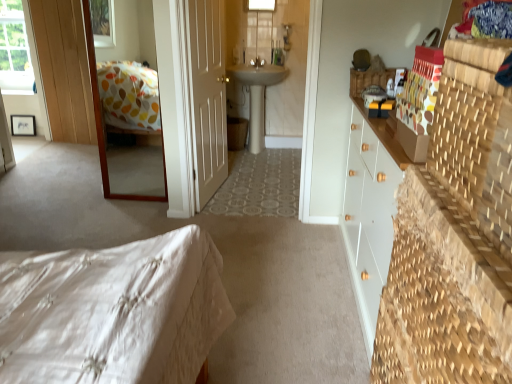
Find the location of a particular element. This screenshot has height=384, width=512. wooden-framed mirror at upper left is located at coordinates (126, 122).

At what (x,y) coordinates should I click in order to perform the action: click on white matte door at center. Please return your answer as a coordinate pair (x, y). Looking at the image, I should click on (207, 96).

Describe the element at coordinates (257, 96) in the screenshot. The height and width of the screenshot is (384, 512). I see `white ceramic sink at center` at that location.

Where is `wooden-framed mirror at upper left`? The height and width of the screenshot is (384, 512). wooden-framed mirror at upper left is located at coordinates (126, 122).

Could transparent glass window at upper center, placed as the first window when sorted from right to left, be considered to be inside wooden-framed mirror at upper left?

No, wooden-framed mirror at upper left does not contain transparent glass window at upper center, placed as the first window when sorted from right to left.

In the image, is wooden-framed mirror at upper left on the left side or the right side of transparent glass window at upper center, which ranks as the second window in back-to-front order?

In the image, wooden-framed mirror at upper left appears on the left side of transparent glass window at upper center, which ranks as the second window in back-to-front order.

Does point (146, 190) lie behind point (275, 0)?

No, it is not.

Looking at this image, from a real-world perspective, relative to transparent glass window at upper center, which is the 1th window in front-to-back order, is wooden-framed mirror at upper left vertically above or below?

wooden-framed mirror at upper left is situated lower than transparent glass window at upper center, which is the 1th window in front-to-back order, in the real world.

In the scene shown: Between wooden-framed mirror at upper left and white matte door at center, which one has less height?

With less height is wooden-framed mirror at upper left.

Is wooden-framed mirror at upper left in contact with white matte door at center?

There is a gap between wooden-framed mirror at upper left and white matte door at center.

Considering the points (127, 129) and (203, 117), which point is behind, point (127, 129) or point (203, 117)?

The point (127, 129) is more distant.

Which is behind, point (5, 82) or point (261, 72)?

The point (5, 82) is farther.

Is transparent glass window at upper left, which is the 2th window from front to back, not close to white ceramic sink at center?

transparent glass window at upper left, which is the 2th window from front to back, is far away from white ceramic sink at center.

Which object is thinner, transparent glass window at upper left, which is the first window in back-to-front order, or white ceramic sink at center?

transparent glass window at upper left, which is the first window in back-to-front order.

In the scene shown: Could you tell me if transparent glass window at upper left, which is the first window in back-to-front order, is turned towards white ceramic sink at center?

No, transparent glass window at upper left, which is the first window in back-to-front order, is not oriented towards white ceramic sink at center.

From the image's perspective, which one is positioned higher, wooden-framed mirror at upper left or transparent glass window at upper left, the 1th window in the left-to-right sequence?

transparent glass window at upper left, the 1th window in the left-to-right sequence, is shown above in the image.

Between wooden-framed mirror at upper left and transparent glass window at upper left, which is the 2th window from front to back, which one has less height?

transparent glass window at upper left, which is the 2th window from front to back, is shorter.

Considering the relative sizes of wooden-framed mirror at upper left and transparent glass window at upper left, the 1th window in the left-to-right sequence, in the image provided, is wooden-framed mirror at upper left smaller than transparent glass window at upper left, the 1th window in the left-to-right sequence,?

Yes, wooden-framed mirror at upper left is smaller than transparent glass window at upper left, the 1th window in the left-to-right sequence.

Considering the positions of points (126, 129) and (3, 72), is point (126, 129) closer to camera compared to point (3, 72)?

No, it is behind (3, 72).

Is transparent glass window at upper left, which is counted as the second window, starting from the right, touching white quilted bed at lower left?

No, transparent glass window at upper left, which is counted as the second window, starting from the right, is not with white quilted bed at lower left.

In the scene shown: Can you confirm if transparent glass window at upper left, which is the 2th window from front to back, is bigger than white quilted bed at lower left?

No, transparent glass window at upper left, which is the 2th window from front to back, is not bigger than white quilted bed at lower left.

Is transparent glass window at upper left, which is counted as the second window, starting from the right, turned away from white quilted bed at lower left?

transparent glass window at upper left, which is counted as the second window, starting from the right, is not turned away from white quilted bed at lower left.

Is transparent glass window at upper left, which is the first window in back-to-front order, in front of or behind white quilted bed at lower left in the image?

Clearly, transparent glass window at upper left, which is the first window in back-to-front order, is behind white quilted bed at lower left.

Where is `mirror behind the white matte door at center`? mirror behind the white matte door at center is located at coordinates (126, 122).

Could you tell me if white matte door at center is turned towards wooden-framed mirror at upper left?

No.

Considering the sizes of objects white matte door at center and wooden-framed mirror at upper left in the image provided, who is taller, white matte door at center or wooden-framed mirror at upper left?

white matte door at center.

From a real-world perspective, which is physically above, white matte door at center or wooden-framed mirror at upper left?

In real-world perspective, white matte door at center is above.

Who is shorter, white ceramic sink at center or white quilted bed at lower left?

white quilted bed at lower left.

Is white ceramic sink at center not within white quilted bed at lower left?

Yes.

Is white ceramic sink at center with white quilted bed at lower left?

No, white ceramic sink at center is not next to white quilted bed at lower left.

Find the location of a particular element. The height and width of the screenshot is (384, 512). the 2nd window above when counting from the wooden-framed mirror at upper left (from the image's perspective) is located at coordinates (260, 5).

Locate an element on the screen. mirror directly beneath the white matte door at center (from a real-world perspective) is located at coordinates (126, 122).

Looking at the image, which one is located further to white matte door at center, wooden-framed mirror at upper left or transparent glass window at upper left, which is the 2th window from front to back?

transparent glass window at upper left, which is the 2th window from front to back, is further to white matte door at center.

From the image, which object appears to be farther from white matte door at center, wooden-framed mirror at upper left or transparent glass window at upper center, placed as the first window when sorted from right to left?

transparent glass window at upper center, placed as the first window when sorted from right to left, is positioned further to the anchor white matte door at center.

Which object lies further to the anchor point transparent glass window at upper left, which is counted as the second window, starting from the right, white quilted bed at lower left or white matte door at center?

Based on the image, white quilted bed at lower left appears to be further to transparent glass window at upper left, which is counted as the second window, starting from the right.

Based on their spatial positions, is transparent glass window at upper left, which is the 2th window from front to back, or white matte door at center closer to white quilted bed at lower left?

white matte door at center lies closer to white quilted bed at lower left than the other object.

Looking at the image, which one is located closer to white matte door at center, white ceramic sink at center or white quilted bed at lower left?

white ceramic sink at center.

Which object lies further to the anchor point white ceramic sink at center, transparent glass window at upper center, which ranks as the second window in back-to-front order, or white quilted bed at lower left?

white quilted bed at lower left.

Looking at the image, which one is located further to transparent glass window at upper center, placed as the first window when sorted from right to left, transparent glass window at upper left, the 1th window in the left-to-right sequence, or white ceramic sink at center?

transparent glass window at upper left, the 1th window in the left-to-right sequence, is further to transparent glass window at upper center, placed as the first window when sorted from right to left.

Estimate the real-world distances between objects in this image. Which object is closer to white quilted bed at lower left, white matte door at center or wooden-framed mirror at upper left?

white matte door at center is closer to white quilted bed at lower left.

Identify the location of mirror located between white quilted bed at lower left and transparent glass window at upper left, which is the first window in back-to-front order, in the depth direction. (126, 122).

Identify the location of sink located between wooden-framed mirror at upper left and transparent glass window at upper center, placed as the first window when sorted from right to left, in the depth direction. (257, 96).

At what (x,y) coordinates should I click in order to perform the action: click on mirror located between white matte door at center and transparent glass window at upper center, which is the 1th window in front-to-back order, in the depth direction. Please return your answer as a coordinate pair (x, y). Image resolution: width=512 pixels, height=384 pixels. Looking at the image, I should click on (126, 122).

Identify the location of mirror between transparent glass window at upper left, which is counted as the second window, starting from the right, and white ceramic sink at center, in the horizontal direction. The height and width of the screenshot is (384, 512). (126, 122).